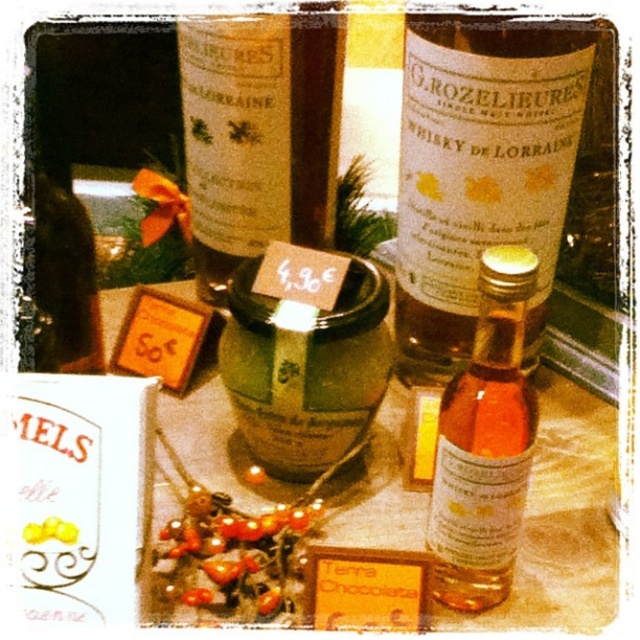
Is point (528, 176) more distant than point (499, 468)?

Yes, point (528, 176) is behind point (499, 468).

Is matte glass whisky bottle at center taller than translucent amber glass bottle at center-right?

Yes.

What do you see at coordinates (481, 170) in the screenshot? This screenshot has width=640, height=640. I see `matte glass whisky bottle at center` at bounding box center [481, 170].

The image size is (640, 640). Identify the location of matte glass whisky bottle at center. (481, 170).

Is translucent glass jar at center smaller than matte glass bottle at center?

No, translucent glass jar at center is not smaller than matte glass bottle at center.

Identify the location of translucent glass jar at center. (376, 520).

Who is more distant from viewer, (x=355, y=513) or (x=292, y=227)?

Positioned behind is point (x=292, y=227).

Where is `translucent glass jar at center`? This screenshot has height=640, width=640. translucent glass jar at center is located at coordinates (376, 520).

Which is in front, point (342, 598) or point (486, 547)?

Point (342, 598) is in front.

Who is more forward, [150,579] or [488,248]?

Point [150,579]

I want to click on translucent glass jar at center, so click(376, 520).